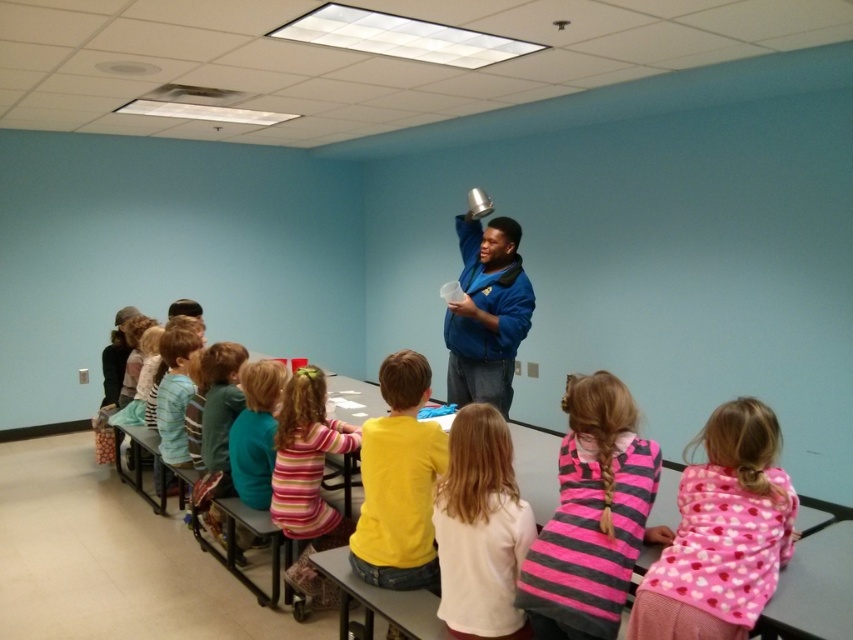
Can you confirm if pink striped sweater at center is taller than white matte shirt at center?

Yes.

Looking at this image, is pink striped sweater at center wider than white matte shirt at center?

Yes.

This screenshot has width=853, height=640. Find the location of `pink striped sweater at center`. pink striped sweater at center is located at coordinates (592, 516).

Identify the location of pink striped sweater at center. (592, 516).

Who is taller, pink fleece sweater at lower right or white matte shirt at center?

white matte shirt at center

What do you see at coordinates (722, 532) in the screenshot?
I see `pink fleece sweater at lower right` at bounding box center [722, 532].

Between point (718, 493) and point (456, 582), which one is positioned behind?

The point (456, 582) is more distant.

Find the location of a particular element. Image resolution: width=853 pixels, height=640 pixels. pink fleece sweater at lower right is located at coordinates (722, 532).

Does point (486, 490) lie behind point (511, 394)?

That is False.

Does white matte shirt at center appear over blue fleece jacket at center?

No.

You are a GUI agent. You are given a task and a screenshot of the screen. Output one action in this format:
    pyautogui.click(x=<x>, y=<y>)
    Task: Click on the white matte shirt at center
    
    Given the screenshot: What is the action you would take?
    pyautogui.click(x=480, y=529)